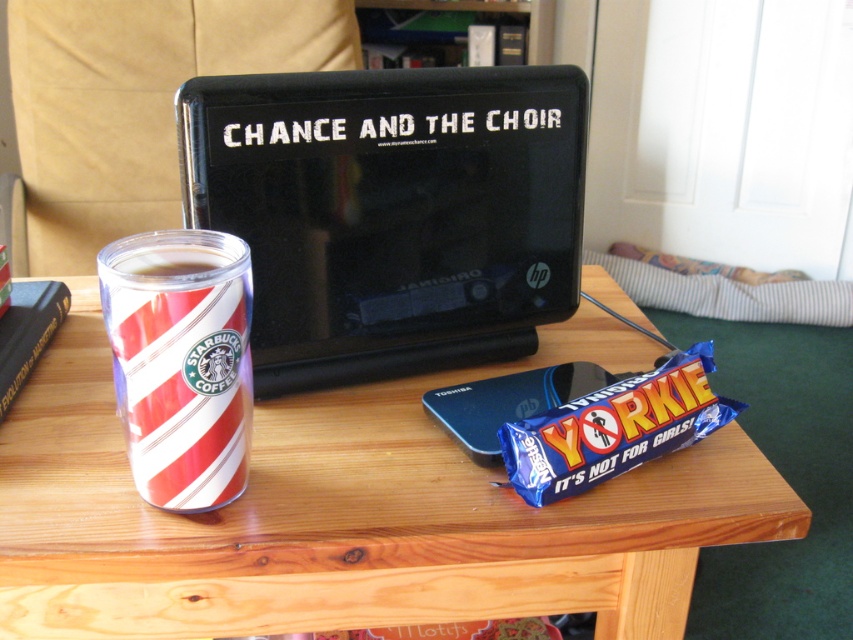
You are standing in the room and want to place a 24 inch wide laptop bag on the wooden table at center. Can you fit it on the table?

The wooden table at center is 22.42 inches from viewer, so the 24 inch wide laptop bag may not fit if the table is narrower than the bag. However, the description only provides the distance from the viewer, not the table dimensions. Further details about the table size are needed to determine if it can fit.